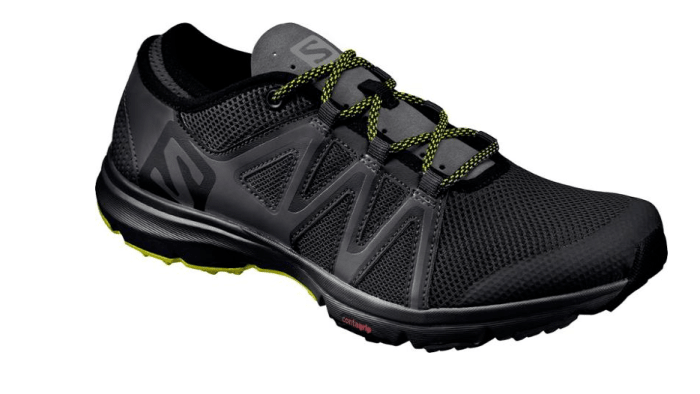
The image size is (700, 394). I want to click on cushion, so click(x=208, y=97).